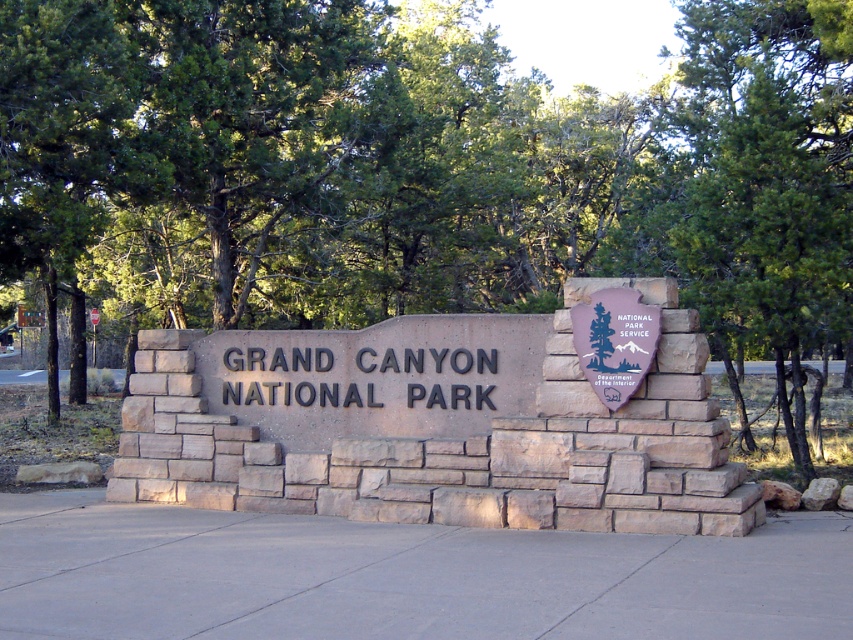
Between point (163, 518) and point (616, 336), which one is positioned behind?

Positioned behind is point (163, 518).

Looking at this image, who is higher up, gray concrete pavement at center or purple stone shield at center?

purple stone shield at center

Consider the image. Measure the distance between gray concrete pavement at center and camera.

A distance of 24.37 feet exists between gray concrete pavement at center and camera.

The height and width of the screenshot is (640, 853). Find the location of `gray concrete pavement at center`. gray concrete pavement at center is located at coordinates (403, 577).